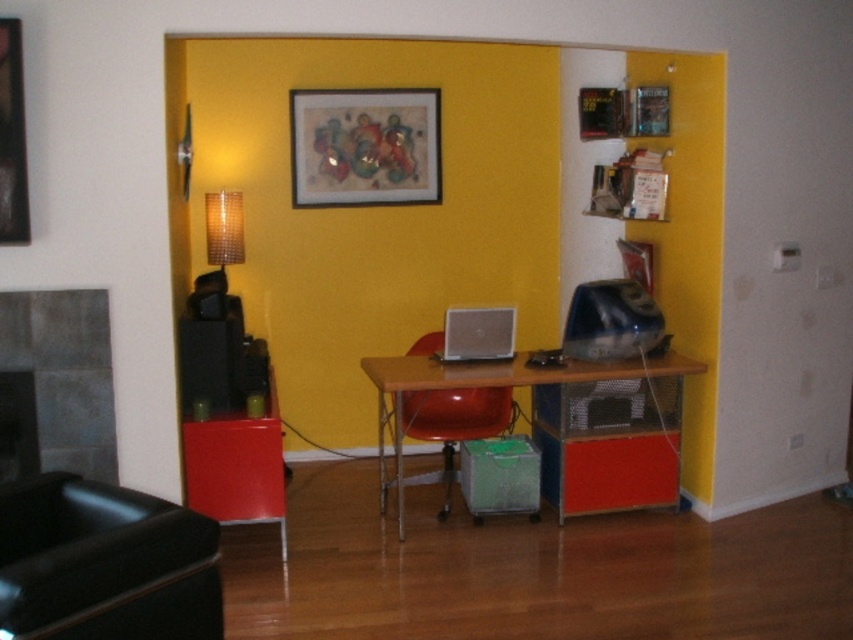
Between matte red chair at center and silver metallic laptop at center, which one is positioned higher?

Positioned higher is silver metallic laptop at center.

Who is lower down, matte red chair at center or silver metallic laptop at center?

matte red chair at center is lower down.

Locate an element on the screen. This screenshot has height=640, width=853. matte red chair at center is located at coordinates (454, 420).

Is matte black swivel chair at lower left to the left of wooden picture frame at upper left from the viewer's perspective?

In fact, matte black swivel chair at lower left is to the right of wooden picture frame at upper left.

Which is more to the right, matte black swivel chair at lower left or wooden picture frame at upper left?

From the viewer's perspective, matte black swivel chair at lower left appears more on the right side.

Between point (51, 630) and point (7, 145), which one is positioned behind?

The point (7, 145) is more distant.

Find the location of a particular element. The image size is (853, 640). matte black swivel chair at lower left is located at coordinates (103, 563).

Between matte wooden picture frame at upper center and woven fabric lampshade at left, which one is positioned higher?

matte wooden picture frame at upper center

Can you confirm if matte wooden picture frame at upper center is smaller than woven fabric lampshade at left?

Actually, matte wooden picture frame at upper center might be larger than woven fabric lampshade at left.

This screenshot has width=853, height=640. In order to click on matte wooden picture frame at upper center in this screenshot , I will do `click(364, 147)`.

This screenshot has width=853, height=640. Find the location of `matte wooden picture frame at upper center`. matte wooden picture frame at upper center is located at coordinates (364, 147).